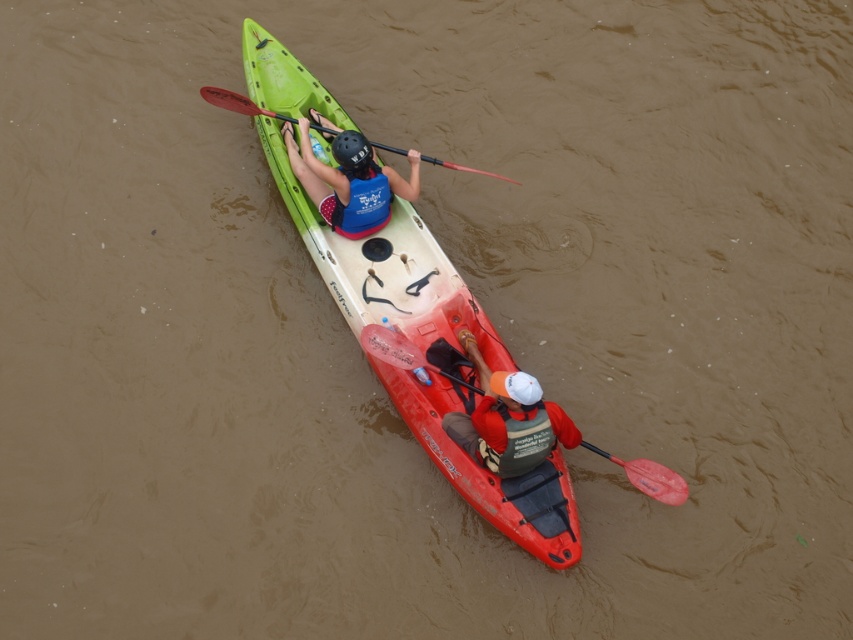
Question: Is green fabric life jacket at center below blue fabric life jacket at upper center?

Choices:
 (A) yes
 (B) no

Answer: (A)

Question: Which point is closer to the camera?

Choices:
 (A) red plastic paddle at upper center
 (B) green fabric life jacket at center
 (C) matte blue life vest at center
 (D) green matte kayak at upper center

Answer: (B)

Question: Is matte blue life vest at center above rubber paddle at lower right?

Choices:
 (A) yes
 (B) no

Answer: (A)

Question: Does blue fabric life jacket at upper center have a lesser width compared to red plastic paddle at upper center?

Choices:
 (A) yes
 (B) no

Answer: (A)

Question: Which of the following is the farthest from the observer?

Choices:
 (A) rubber paddle at lower right
 (B) red plastic paddle at upper center
 (C) green fabric life jacket at center
 (D) orange fabric kayak at center

Answer: (B)

Question: Among these objects, which one is farthest from the camera?

Choices:
 (A) matte blue life vest at center
 (B) orange fabric kayak at center
 (C) green matte kayak at upper center

Answer: (A)